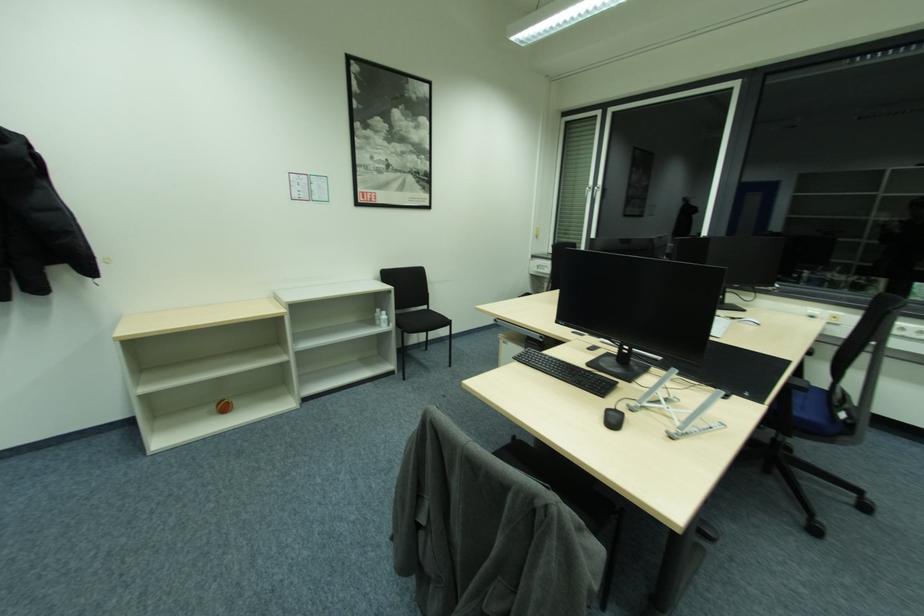
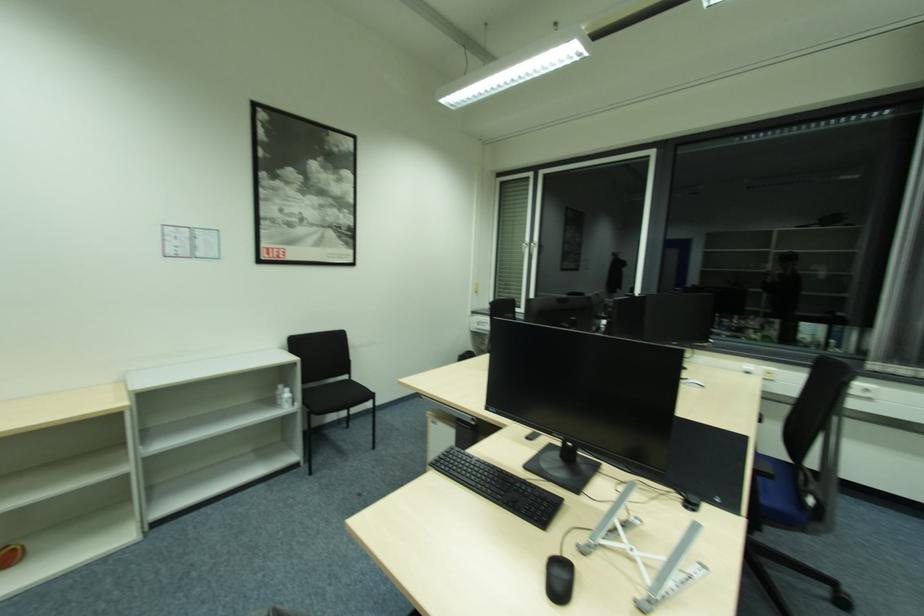
What movement of the cameraman would produce the second image?

The movement direction of the cameraman is right, forward.